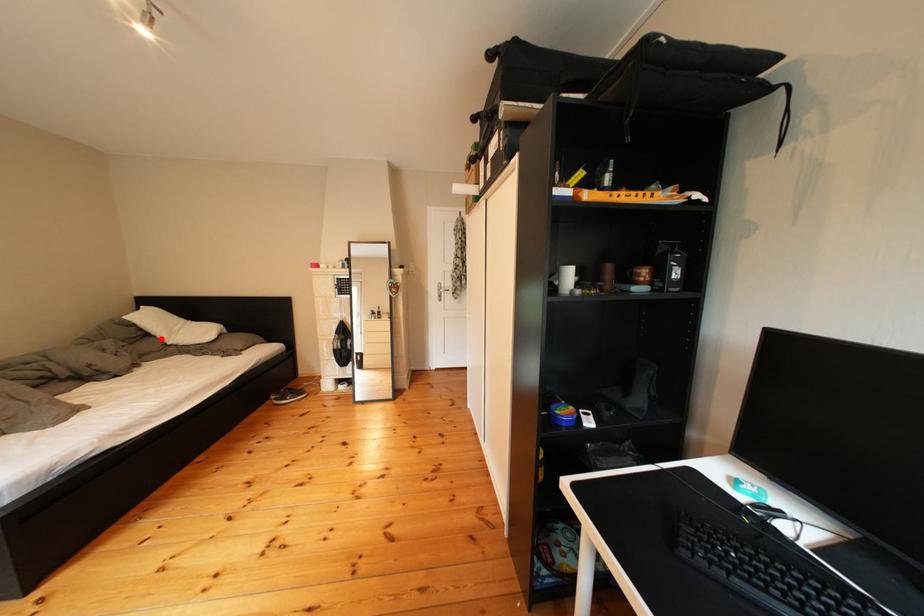
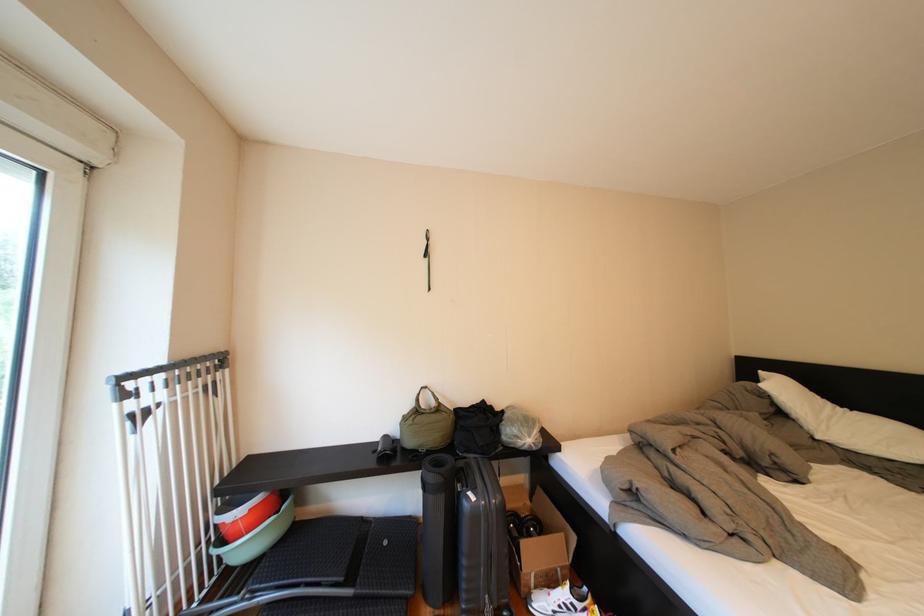
Where in the second image is the point corresponding to the highlighted location from the first image?

(795, 419)